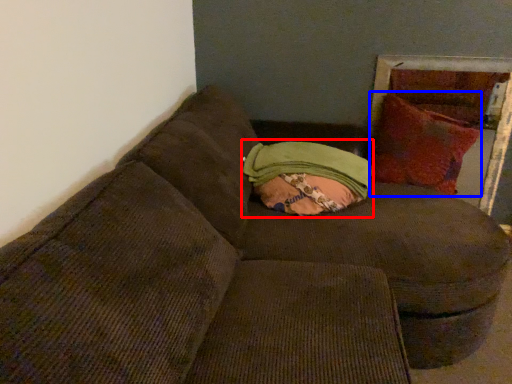
Question: Among these objects, which one is farthest to the camera, bean bag chair (highlighted by a red box) or throw pillow (highlighted by a blue box)?

Choices:
 (A) bean bag chair
 (B) throw pillow

Answer: (B)